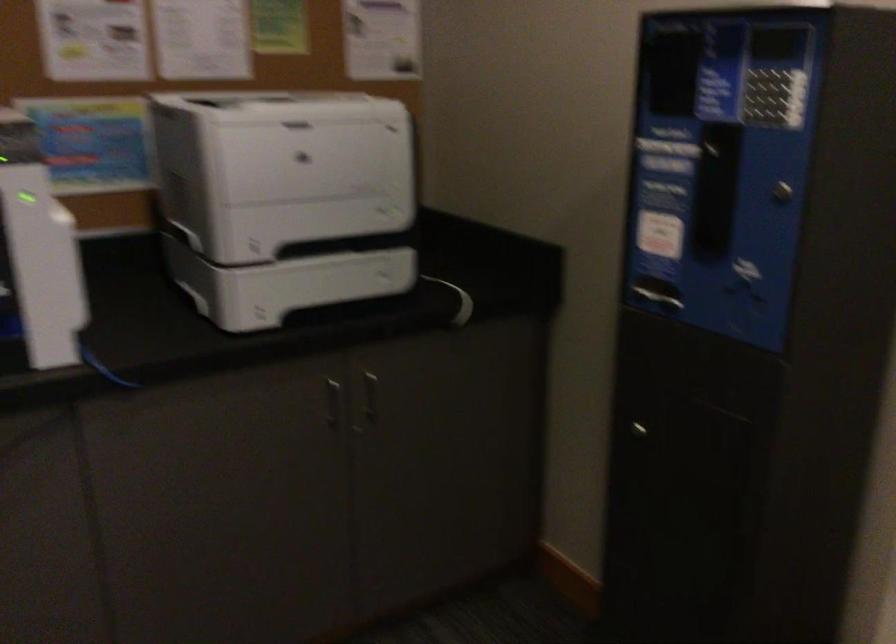
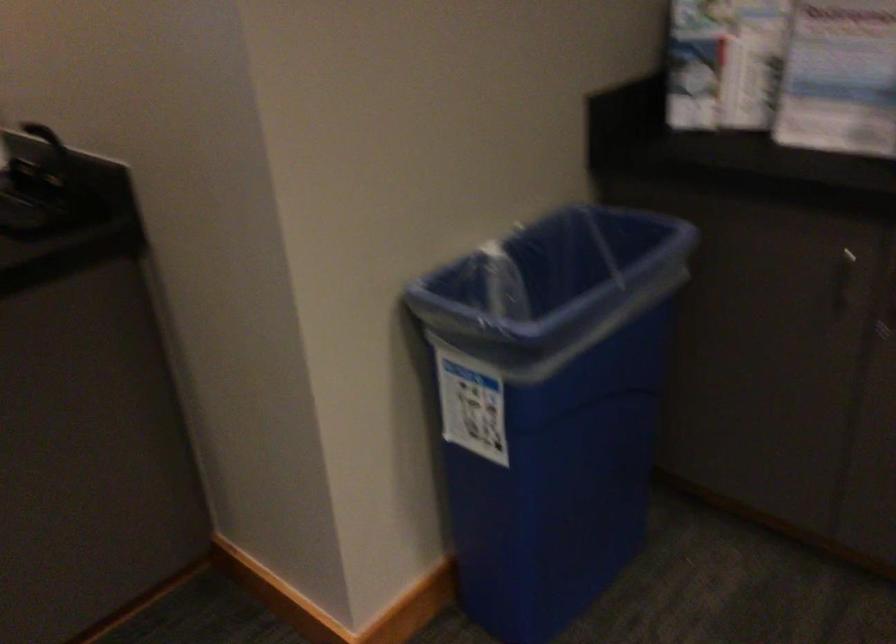
The first image is from the beginning of the video and the second image is from the end. How did the camera likely rotate when shooting the video?

The rotation direction of the camera is left-down.